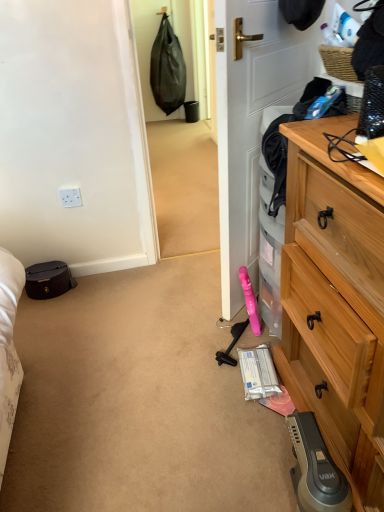
Identify the location of free space that is to the left of wooden chest of drawers at right. Image resolution: width=384 pixels, height=512 pixels. (201, 428).